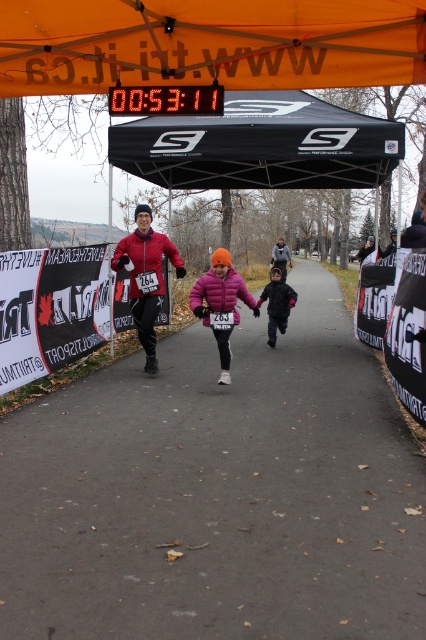
Question: Is gray asphalt road at center below matte pink jacket at center?

Choices:
 (A) yes
 (B) no

Answer: (A)

Question: Does gray asphalt road at center appear under black fabric canopy at upper center?

Choices:
 (A) no
 (B) yes

Answer: (B)

Question: Which object appears farthest from the camera in this image?

Choices:
 (A) orange fabric canopy at upper center
 (B) gray asphalt road at center
 (C) matte pink jacket at center

Answer: (C)

Question: Does pink fleece jacket at center appear under matte pink jacket at center?

Choices:
 (A) no
 (B) yes

Answer: (B)

Question: Which is farther from the black fuzzy hat at center?

Choices:
 (A) orange fabric canopy at upper center
 (B) black fabric canopy at upper center
 (C) gray asphalt road at center

Answer: (A)

Question: Which object is the closest to the orange fabric canopy at upper center?

Choices:
 (A) gray asphalt road at center
 (B) black fuzzy hat at center
 (C) matte red jacket at center

Answer: (C)